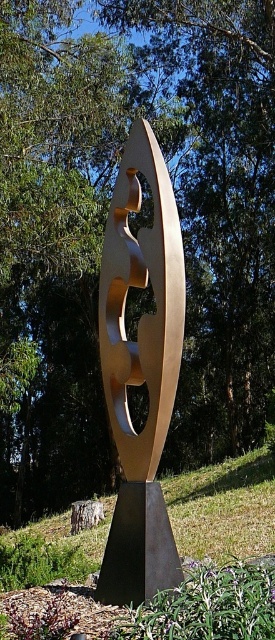
Does gold polished metal abstract art at center have a smaller size compared to gold polished sculpture at center?

Yes.

Is point (161, 502) more distant than point (232, 486)?

No, (161, 502) is closer to viewer.

Where is `gold polished metal abstract art at center`? This screenshot has height=640, width=275. gold polished metal abstract art at center is located at coordinates (x=141, y=371).